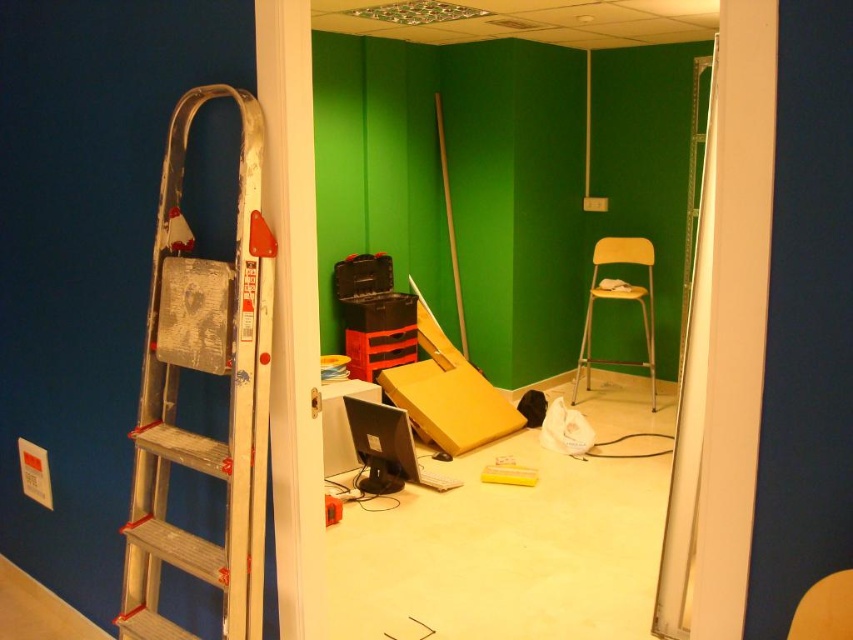
You are standing in the room and want to reach the recessed light fixture on the ceiling. The ladder you see is the only one available. Is the silver metallic ladder at left long enough to reach the fixture if it is 2.5 meters above the floor?

The silver metallic ladder at left is 1.66 meters from viewer. Since the ladder is placed against the wall, its height would be approximately equal to its distance from the viewer plus its own length. However, without knowing the ladder length, we cannot determine if it reaches the 2.5 meter fixture. More information is needed.

You are a worker in the room and need to move the matte black monitor at center to the other side of the room. To do this, you must first move the silver metallic ladder at left. Which object should you move first according to their positions?

The silver metallic ladder at left should be moved first because it is closer to the viewer than the matte black monitor at center, so it is in the way.